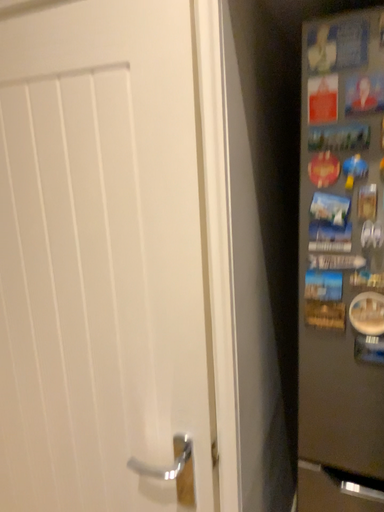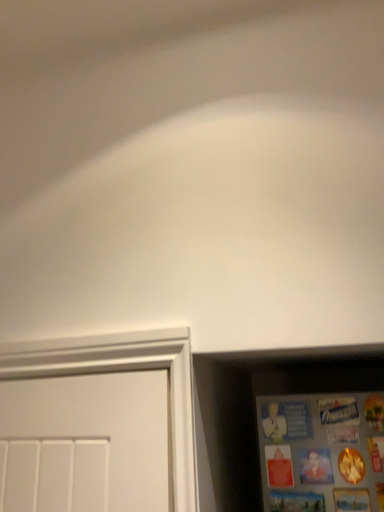
Question: How did the camera likely rotate when shooting the video?

Choices:
 (A) rotated left
 (B) rotated right

Answer: (B)